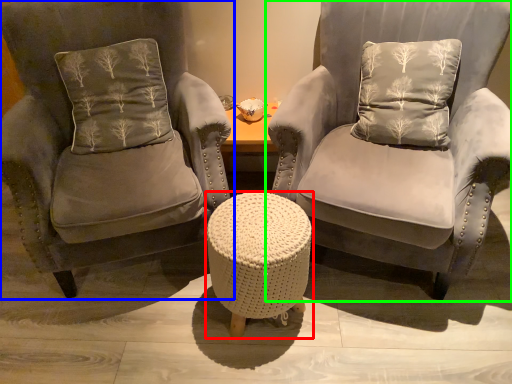
Question: Based on their relative distances, which object is farther from table (highlighted by a red box)? Choose from chair (highlighted by a blue box) and chair (highlighted by a green box).

Choices:
 (A) chair
 (B) chair

Answer: (A)